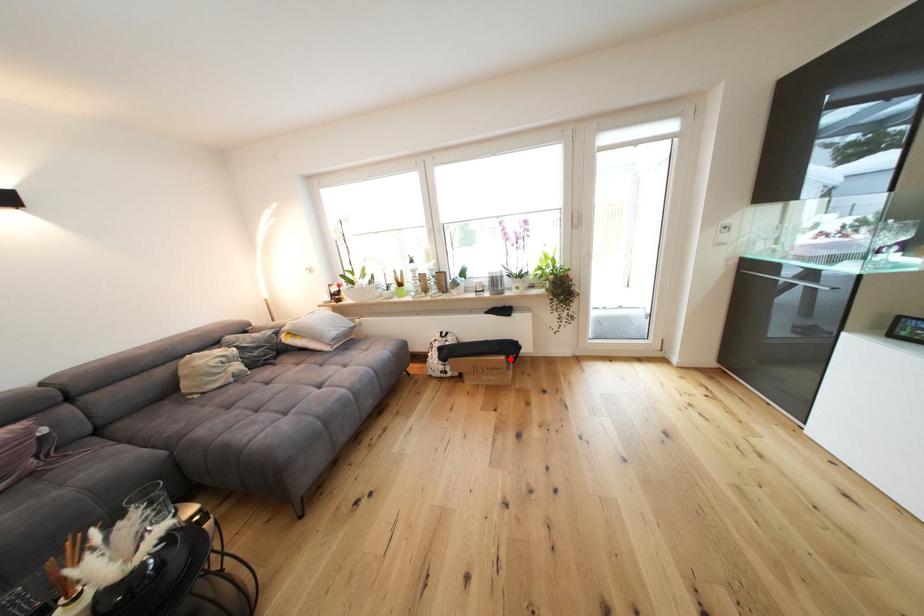
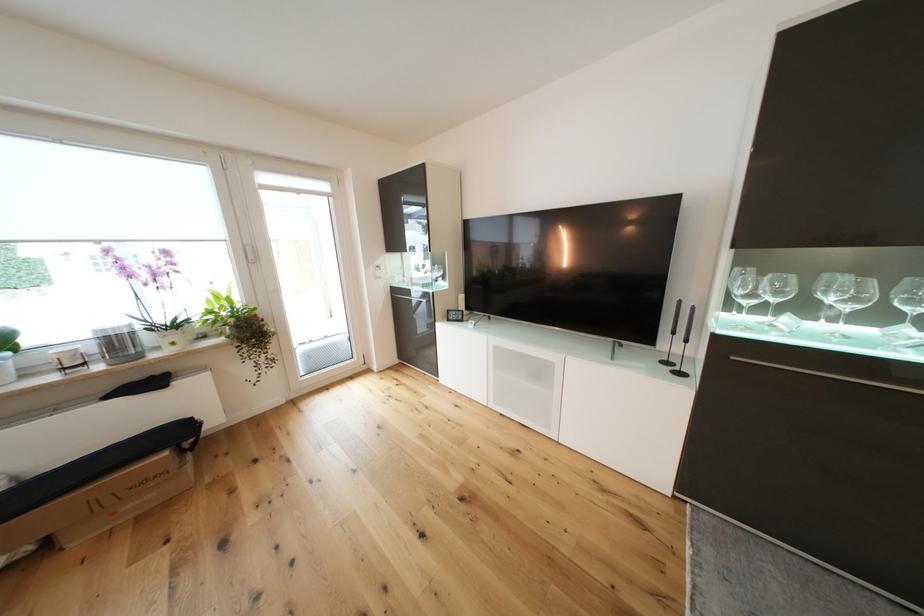
Where in the second image is the point corresponding to the highlighted location from the first image?

(172, 455)